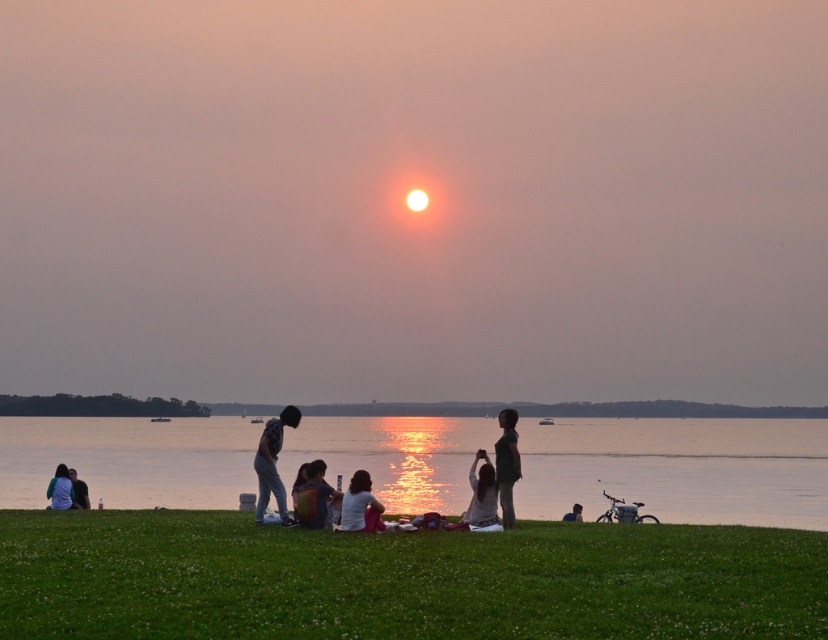
Who is positioned more to the right, dark green fabric shirt at center or light blue fabric at lower left?

dark green fabric shirt at center is more to the right.

Does dark green fabric shirt at center have a greater height compared to light blue fabric at lower left?

In fact, dark green fabric shirt at center may be shorter than light blue fabric at lower left.

Which is in front, point (503, 492) or point (59, 497)?

Point (503, 492)

Image resolution: width=828 pixels, height=640 pixels. Find the location of `dark green fabric shirt at center`. dark green fabric shirt at center is located at coordinates (506, 464).

Describe the element at coordinates (480, 493) in the screenshot. The height and width of the screenshot is (640, 828). I see `matte gray shirt at center` at that location.

Does point (482, 513) lie behind point (66, 483)?

That is False.

You are a GUI agent. You are given a task and a screenshot of the screen. Output one action in this format:
    pyautogui.click(x=<x>, y=<y>)
    Task: Click on the matte gray shirt at center
    The height and width of the screenshot is (640, 828).
    Given the screenshot: What is the action you would take?
    pyautogui.click(x=480, y=493)

Does green grassy field at lower center have a greater height compared to light blue fabric at lower left?

Incorrect, green grassy field at lower center's height is not larger of light blue fabric at lower left's.

Measure the distance between point (83, 561) and camera.

Point (83, 561) and camera are 16.95 meters apart.

The width and height of the screenshot is (828, 640). In order to click on green grassy field at lower center in this screenshot , I will do `click(402, 579)`.